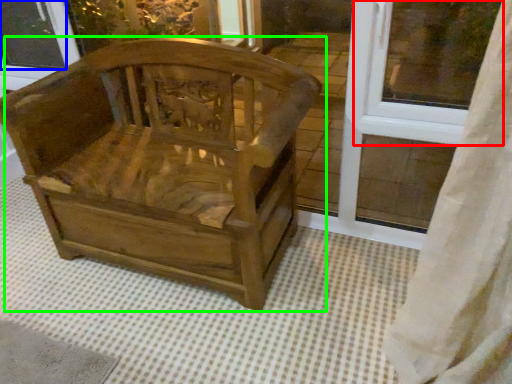
Question: Which is nearer to the window frame (highlighted by a red box)? window screen (highlighted by a blue box) or chair (highlighted by a green box).

Choices:
 (A) window screen
 (B) chair

Answer: (B)